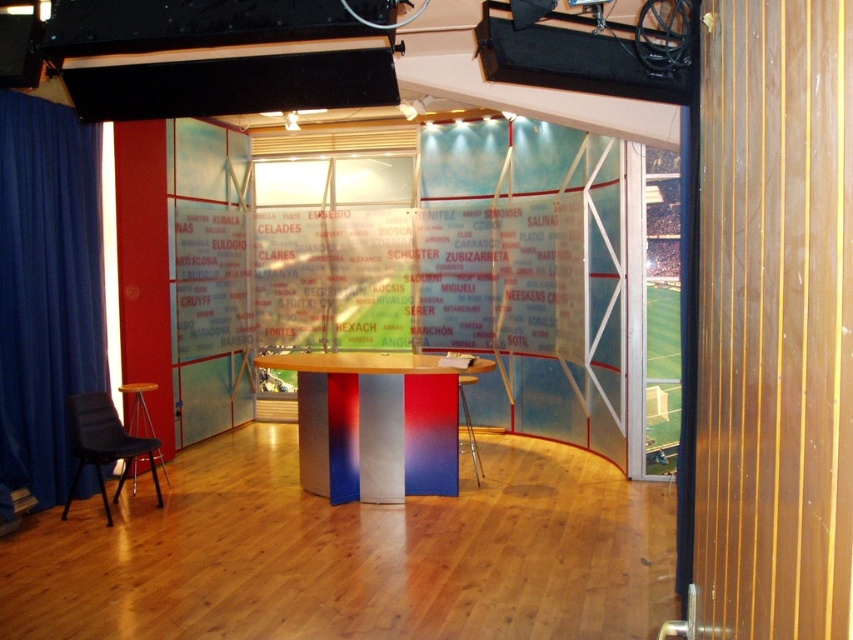
Question: Does metallic gradient table at center have a smaller size compared to metallic stool at center?

Choices:
 (A) yes
 (B) no

Answer: (B)

Question: Which point is closer to the camera?

Choices:
 (A) blue fabric curtain at left
 (B) metallic gradient table at center
 (C) metallic stool at center

Answer: (A)

Question: Does wooden stool at lower left appear over metallic stool at center?

Choices:
 (A) yes
 (B) no

Answer: (A)

Question: Estimate the real-world distances between objects in this image. Which object is closer to the metallic gradient table at center?

Choices:
 (A) black fabric chair at lower left
 (B) blue fabric curtain at left

Answer: (A)

Question: Does metallic gradient table at center have a lesser width compared to metallic stool at center?

Choices:
 (A) yes
 (B) no

Answer: (B)

Question: Among these points, which one is nearest to the camera?

Choices:
 (A) (468, 426)
 (B) (413, 388)
 (C) (143, 413)
 (D) (12, 394)

Answer: (D)